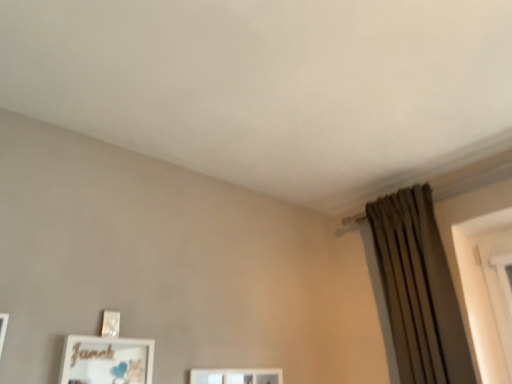
Question: Choose the correct answer: Is matte gold picture frame at lower left inside brown textured curtain at right or outside it?

Choices:
 (A) outside
 (B) inside

Answer: (A)

Question: Considering the positions of matte gold picture frame at lower left and brown textured curtain at right in the image, is matte gold picture frame at lower left wider or thinner than brown textured curtain at right?

Choices:
 (A) wide
 (B) thin

Answer: (B)

Question: From the image's perspective, is matte gold picture frame at lower left located above or below brown textured curtain at right?

Choices:
 (A) below
 (B) above

Answer: (A)

Question: Is brown textured curtain at right bigger or smaller than matte gold picture frame at lower left?

Choices:
 (A) big
 (B) small

Answer: (A)

Question: Considering their positions, is brown textured curtain at right located in front of or behind matte gold picture frame at lower left?

Choices:
 (A) front
 (B) behind

Answer: (B)

Question: From a real-world perspective, is brown textured curtain at right physically located above or below matte gold picture frame at lower left?

Choices:
 (A) above
 (B) below

Answer: (A)

Question: Which is correct: brown textured curtain at right is inside matte gold picture frame at lower left, or outside of it?

Choices:
 (A) outside
 (B) inside

Answer: (A)